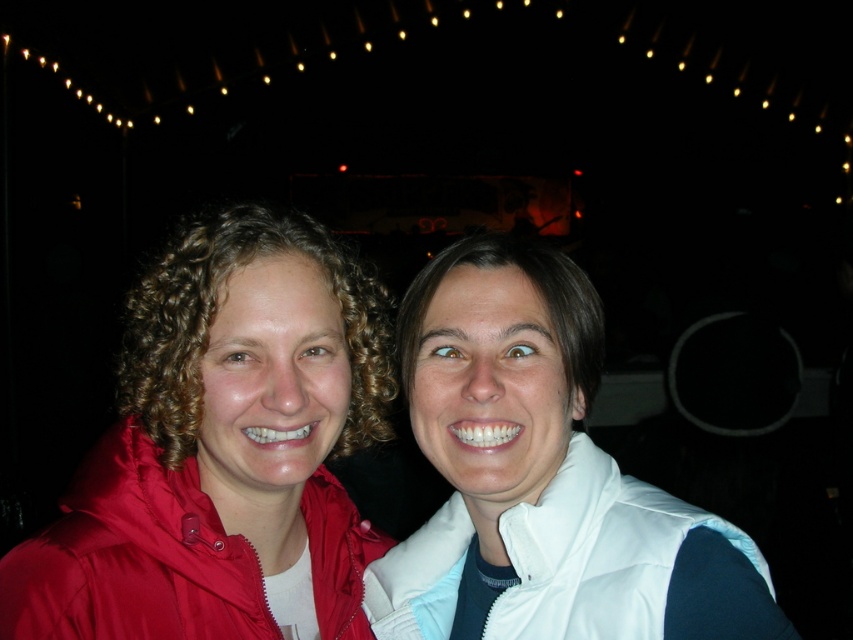
Question: Among these objects, which one is nearest to the camera?

Choices:
 (A) white puffy vest at lower right
 (B) matte red jacket at left

Answer: (B)

Question: Can you confirm if matte red jacket at left is thinner than white puffy vest at lower right?

Choices:
 (A) yes
 (B) no

Answer: (A)

Question: Is matte red jacket at left wider than white puffy vest at lower right?

Choices:
 (A) no
 (B) yes

Answer: (A)

Question: Is matte red jacket at left thinner than white puffy vest at lower right?

Choices:
 (A) no
 (B) yes

Answer: (B)

Question: Among these objects, which one is farthest from the camera?

Choices:
 (A) matte red jacket at left
 (B) white puffy vest at lower right

Answer: (B)